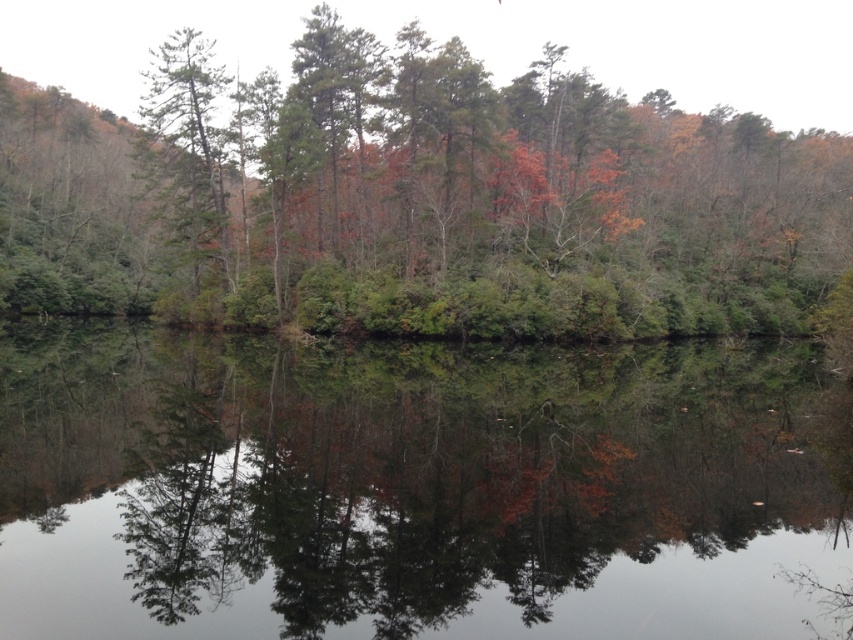
How distant is green matte tree at center from green matte tree at left?

green matte tree at center and green matte tree at left are 187.48 feet apart from each other.

Is green matte tree at center to the left of green matte tree at left from the viewer's perspective?

No, green matte tree at center is not to the left of green matte tree at left.

Who is more forward, (323, 218) or (178, 125)?

Positioned in front is point (178, 125).

Locate an element on the screen. The image size is (853, 640). green matte tree at center is located at coordinates (416, 198).

Which of these two, transparent water at center or green matte tree at center, stands taller?

green matte tree at center

Does transparent water at center lie in front of green matte tree at center?

That is True.

Locate an element on the screen. The width and height of the screenshot is (853, 640). transparent water at center is located at coordinates (408, 490).

Identify the location of transparent water at center. (408, 490).

Is transparent water at center behind green matte tree at left?

No, transparent water at center is in front of green matte tree at left.

Can you confirm if transparent water at center is smaller than green matte tree at left?

Yes, transparent water at center is smaller than green matte tree at left.

I want to click on transparent water at center, so click(x=408, y=490).

This screenshot has width=853, height=640. Identify the location of transparent water at center. (408, 490).